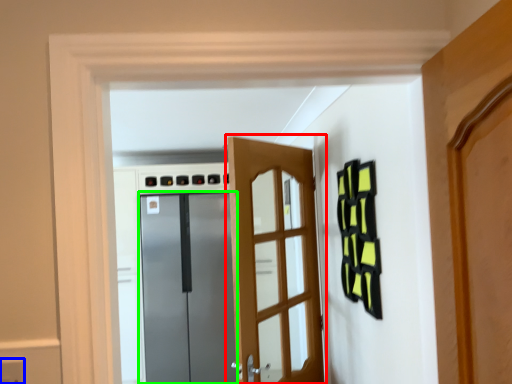
Question: Which is farther away from door (highlighted by a red box)? electric outlet (highlighted by a blue box) or door (highlighted by a green box)?

Choices:
 (A) electric outlet
 (B) door

Answer: (B)